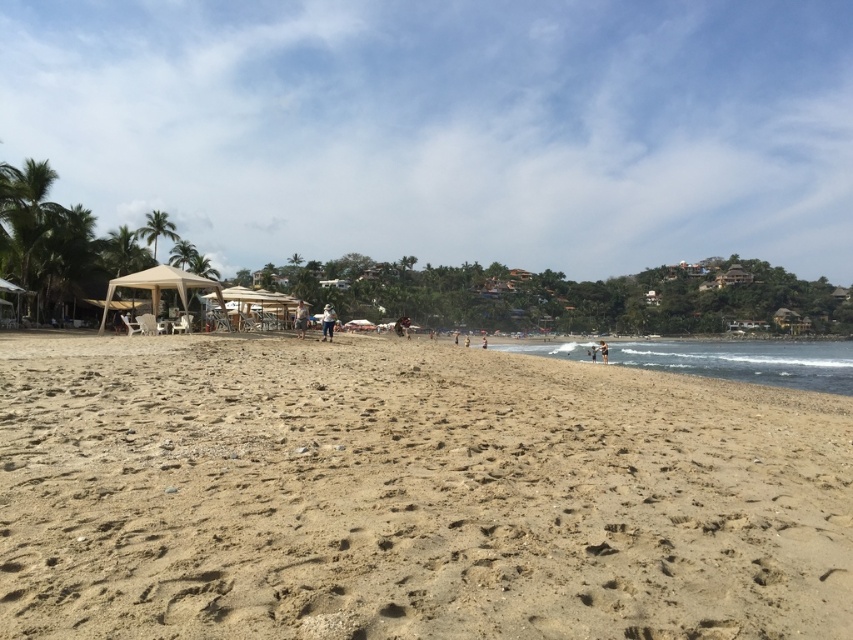
Measure the distance between point (189, 353) and camera.

Point (189, 353) is 11.39 meters away from camera.

Does brown sandy beach at center come in front of brown fabric umbrella at center?

That is True.

Where is `brown sandy beach at center`? This screenshot has width=853, height=640. brown sandy beach at center is located at coordinates (409, 493).

Who is positioned more to the right, light brown sand at center or tan skin person at lower right?

tan skin person at lower right

Is point (321, 337) closer to viewer compared to point (607, 349)?

Yes, it is.

The width and height of the screenshot is (853, 640). Identify the location of light brown sand at center. (328, 321).

Which is above, brown sandy beach at center or tan skin person at lower right?

brown sandy beach at center is above.

Based on the photo, does brown sandy beach at center have a larger size compared to tan skin person at lower right?

No.

Find the location of a particular element. brown sandy beach at center is located at coordinates (409, 493).

At what (x,y) coordinates should I click in order to perform the action: click on brown sandy beach at center. Please return your answer as a coordinate pair (x, y). Looking at the image, I should click on (409, 493).